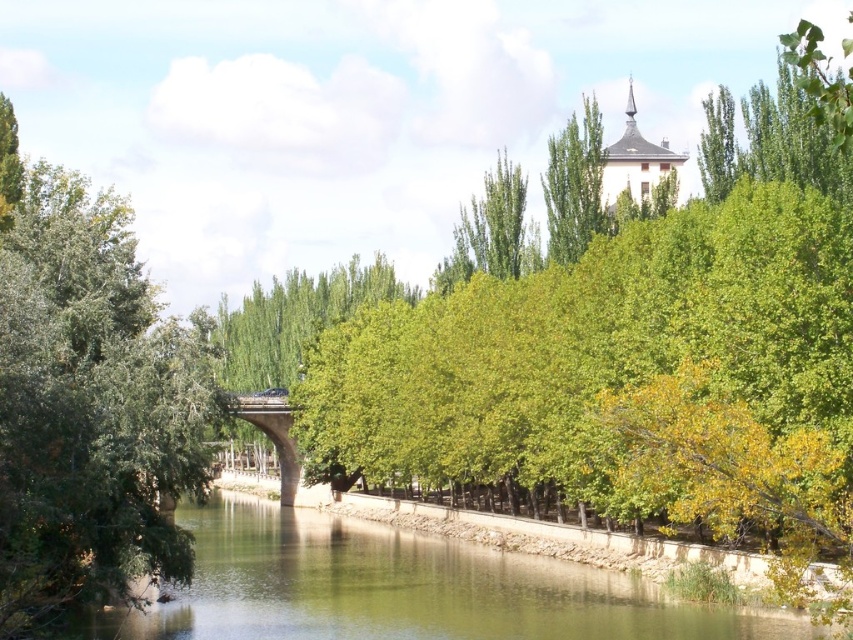
Question: Can you confirm if green leafy tree at left is thinner than white stucco tower at upper center?

Choices:
 (A) no
 (B) yes

Answer: (A)

Question: Which of the following is the farthest from the observer?

Choices:
 (A) (281, 456)
 (B) (585, 243)
 (C) (604, 172)

Answer: (A)

Question: Estimate the real-world distances between objects in this image. Which object is closer to the green leafy tree at left?

Choices:
 (A) green leafy tree at upper center
 (B) concrete bridge at center
 (C) green leafy tree at center

Answer: (B)

Question: Which of the following is the farthest from the observer?

Choices:
 (A) green leafy tree at center
 (B) white stucco tower at upper center
 (C) green smooth water at center
 (D) green leafy tree at left

Answer: (A)

Question: Observing the image, what is the correct spatial positioning of green leafy tree at center in reference to green leafy tree at upper center?

Choices:
 (A) below
 (B) above

Answer: (B)

Question: Considering the relative positions of white stucco tower at upper center and concrete bridge at center in the image provided, where is white stucco tower at upper center located with respect to concrete bridge at center?

Choices:
 (A) left
 (B) right

Answer: (B)